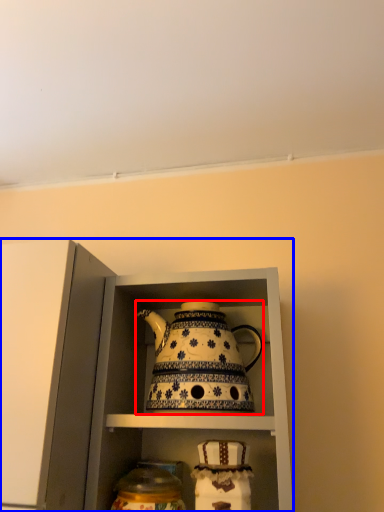
Question: Which point is further to the camera, kettle (highlighted by a red box) or cabinetry (highlighted by a blue box)?

Choices:
 (A) kettle
 (B) cabinetry

Answer: (A)